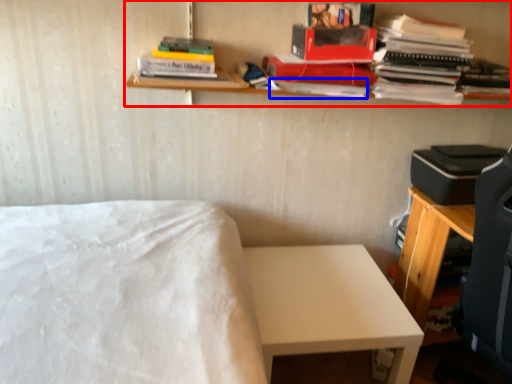
Question: Which point is closer to the camera, shelf (highlighted by a red box) or paperback book (highlighted by a blue box)?

Choices:
 (A) shelf
 (B) paperback book

Answer: (A)